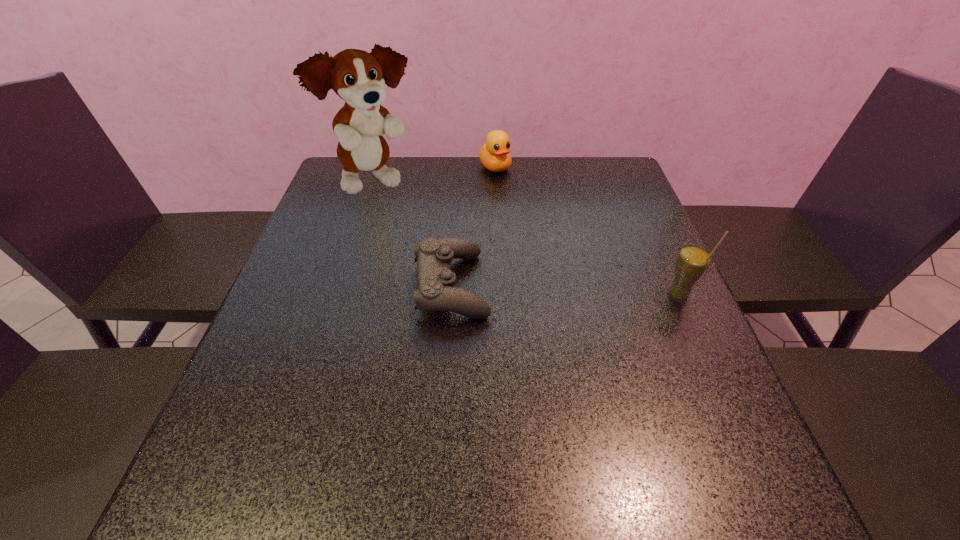
The width and height of the screenshot is (960, 540). Identify the location of free space at the near edge of the desktop. (548, 415).

Where is `free point at the left edge`? free point at the left edge is located at coordinates (298, 265).

I want to click on free space at the right edge, so click(618, 327).

Where is `vacant point at the far left corner`? vacant point at the far left corner is located at coordinates (335, 185).

This screenshot has width=960, height=540. I want to click on free space at the near left corner, so click(x=271, y=406).

You are a GUI agent. You are given a task and a screenshot of the screen. Output one action in this format:
    pyautogui.click(x=<x>, y=<y>)
    Task: Click on the blank space at the near right corner
    
    Given the screenshot: What is the action you would take?
    pyautogui.click(x=702, y=402)

Where is `free area in between the shortest object and the second tallest object`? This screenshot has width=960, height=540. free area in between the shortest object and the second tallest object is located at coordinates (564, 290).

Find the location of a particular element. Image resolution: width=960 pixels, height=540 pixels. free space between the second tallest object and the control is located at coordinates (564, 290).

Where is `unoccupied position between the third tallest object and the tallest object`? unoccupied position between the third tallest object and the tallest object is located at coordinates (436, 175).

The width and height of the screenshot is (960, 540). Identify the location of vacant point located between the shortest object and the duckling. (473, 227).